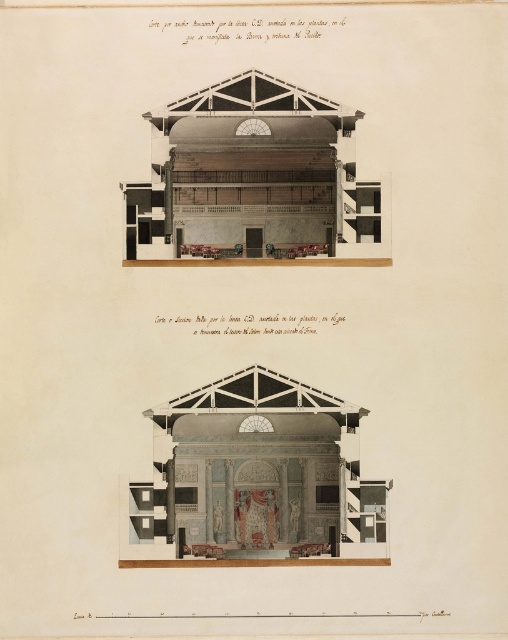
Which is more to the left, matte gray marble stage at center or wooden paneling at center?

wooden paneling at center

Does matte gray marble stage at center have a greater width compared to wooden paneling at center?

Correct, the width of matte gray marble stage at center exceeds that of wooden paneling at center.

You are a GUI agent. You are given a task and a screenshot of the screen. Output one action in this format:
    pyautogui.click(x=<x>, y=<y>)
    Task: Click on the matte gray marble stage at center
    The height and width of the screenshot is (640, 508).
    Given the screenshot: What is the action you would take?
    pyautogui.click(x=254, y=480)